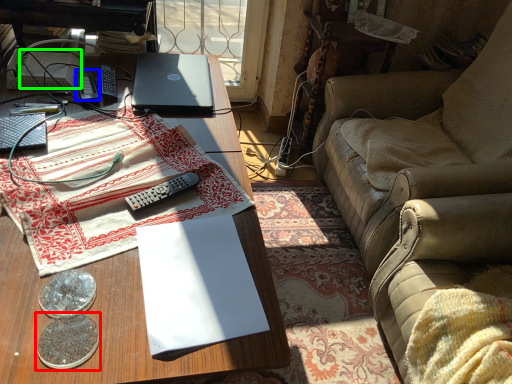
Question: Which is farther away from coin (highlighted by a red box)? remote control (highlighted by a blue box) or paperback book (highlighted by a green box)?

Choices:
 (A) remote control
 (B) paperback book

Answer: (B)